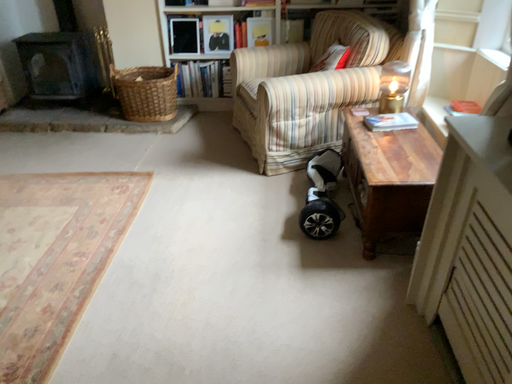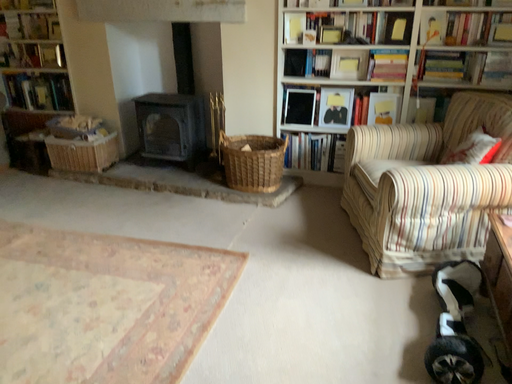
Question: Which way did the camera rotate in the video?

Choices:
 (A) rotated right
 (B) rotated left

Answer: (B)